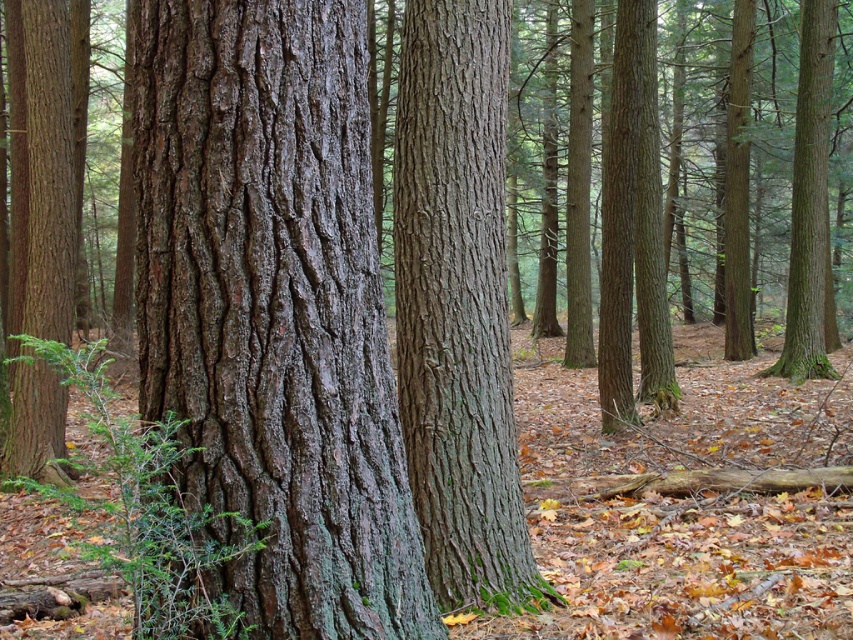
Question: Which object appears farthest from the camera in this image?

Choices:
 (A) smooth bark tree trunk at center
 (B) smooth brown tree trunk at right

Answer: (B)

Question: Considering the relative positions of smooth brown bark at left and smooth brown tree trunk at right in the image provided, where is smooth brown bark at left located with respect to smooth brown tree trunk at right?

Choices:
 (A) above
 (B) below

Answer: (B)

Question: Which of these objects is positioned closest to the smooth brown tree trunk at right?

Choices:
 (A) smooth bark tree trunk at center
 (B) dark brown rough bark at center

Answer: (A)

Question: Among these objects, which one is nearest to the camera?

Choices:
 (A) smooth brown tree trunk at right
 (B) dark brown rough bark at center
 (C) smooth brown bark at left
 (D) smooth bark tree trunk at center

Answer: (B)

Question: Does smooth bark tree trunk at center appear on the left side of smooth brown bark at left?

Choices:
 (A) yes
 (B) no

Answer: (B)

Question: Does dark brown rough bark at center appear on the right side of smooth brown bark at left?

Choices:
 (A) yes
 (B) no

Answer: (A)